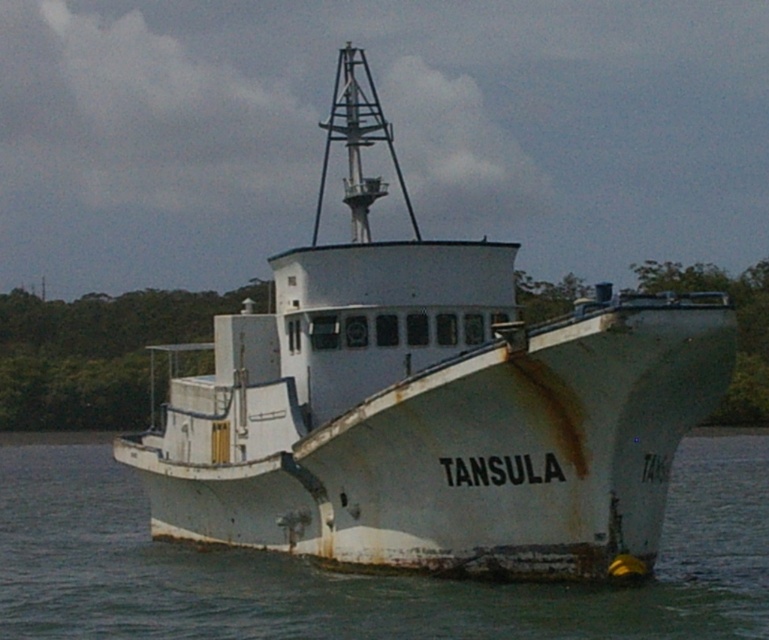
You are an engineer assessing the docking area for the white matte boat at center and the white matte water at center. Which object occupies more horizontal space in the image?

The white matte water at center has a greater width than the white matte boat at center, so the white matte water at center occupies more horizontal space.

You are standing on the dock and see the white matte boat at center. Where exactly is the boat located in relation to the point marked at coordinates (430,404)?

The white matte boat at center is located exactly at the point marked at coordinates (430,404).